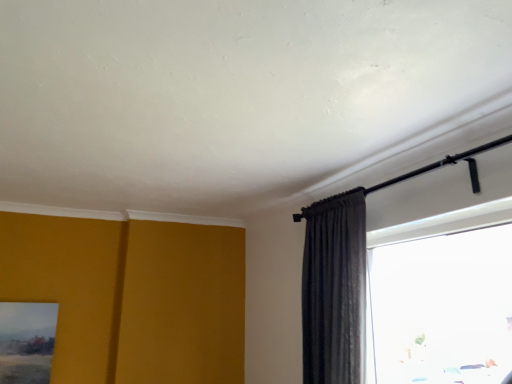
This screenshot has height=384, width=512. What are the coordinates of `dark gray velvet curtain at upper right` in the screenshot? It's located at (x=334, y=288).

Describe the element at coordinates (334, 288) in the screenshot. This screenshot has height=384, width=512. I see `dark gray velvet curtain at upper right` at that location.

Where is `dark gray velvet curtain at upper right`? The image size is (512, 384). dark gray velvet curtain at upper right is located at coordinates (334, 288).